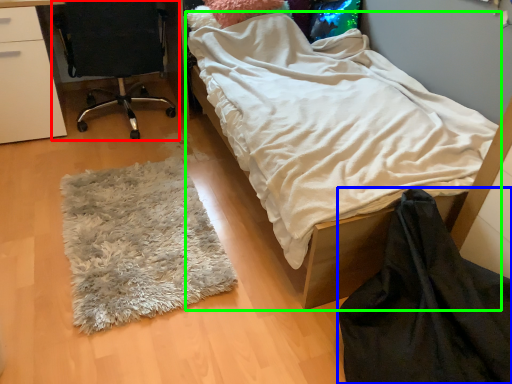
Question: Based on their relative distances, which object is nearer to chair (highlighted by a red box)? Choose from blanket (highlighted by a blue box) and bed (highlighted by a green box).

Choices:
 (A) blanket
 (B) bed

Answer: (B)